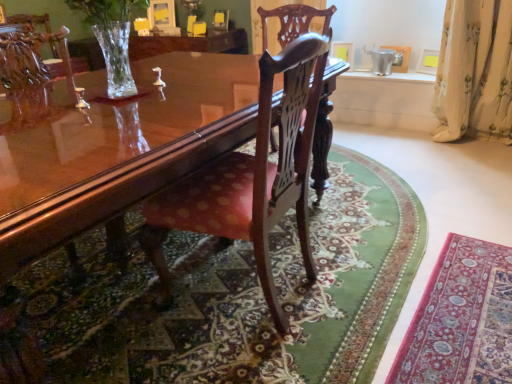
At what (x,y) coordinates should I click in order to perform the action: click on blank space to the left of white floral fabric curtain at right. Please return your answer as a coordinate pair (x, y). This screenshot has width=512, height=384. Looking at the image, I should click on (410, 143).